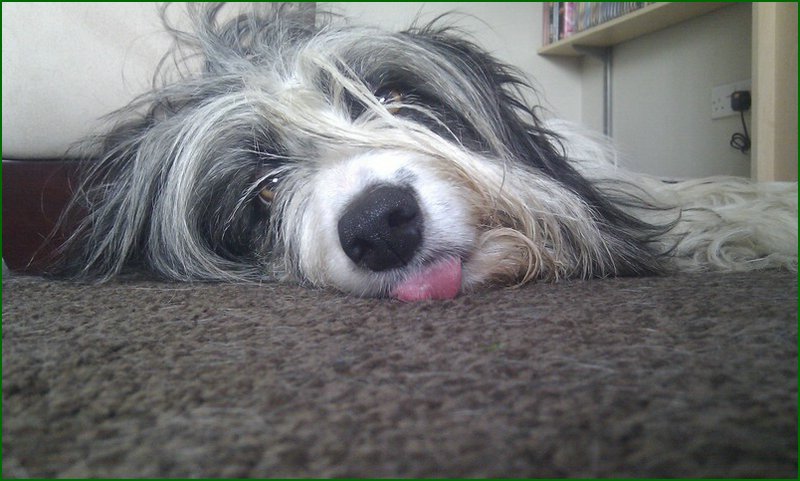
At what (x,y) coordinates should I click in order to perform the action: click on carpet. Please return your answer as a coordinate pair (x, y). Looking at the image, I should click on (313, 371).